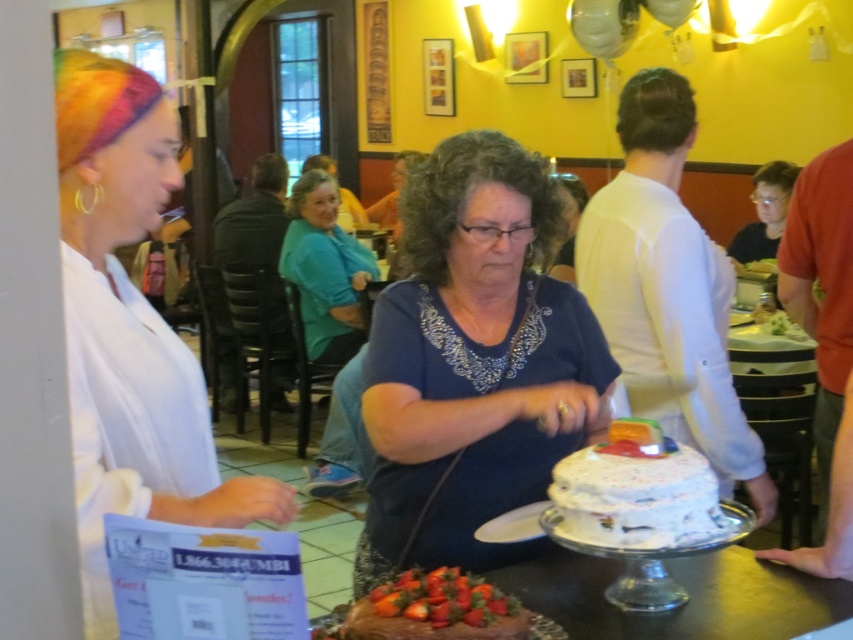
Is blue fabric shirt at center positioned in front of smooth chocolate cake at center?

No, blue fabric shirt at center is further to the viewer.

Does blue fabric shirt at center have a larger size compared to smooth chocolate cake at center?

Correct, blue fabric shirt at center is larger in size than smooth chocolate cake at center.

This screenshot has width=853, height=640. Describe the element at coordinates (473, 362) in the screenshot. I see `blue fabric shirt at center` at that location.

The height and width of the screenshot is (640, 853). I want to click on blue fabric shirt at center, so tap(473, 362).

Is point (175, 124) more distant than point (437, 602)?

Yes.

This screenshot has height=640, width=853. Identify the location of white matte paper at left. (131, 330).

Looking at this image, between white frosted cake at center and smooth chocolate cake at center, which one is positioned lower?

Positioned lower is smooth chocolate cake at center.

From the picture: Who is higher up, white frosted cake at center or smooth chocolate cake at center?

white frosted cake at center is higher up.

Find the location of a particular element. This screenshot has height=640, width=853. white frosted cake at center is located at coordinates (636, 492).

Where is `white frosted cake at center`? white frosted cake at center is located at coordinates (636, 492).